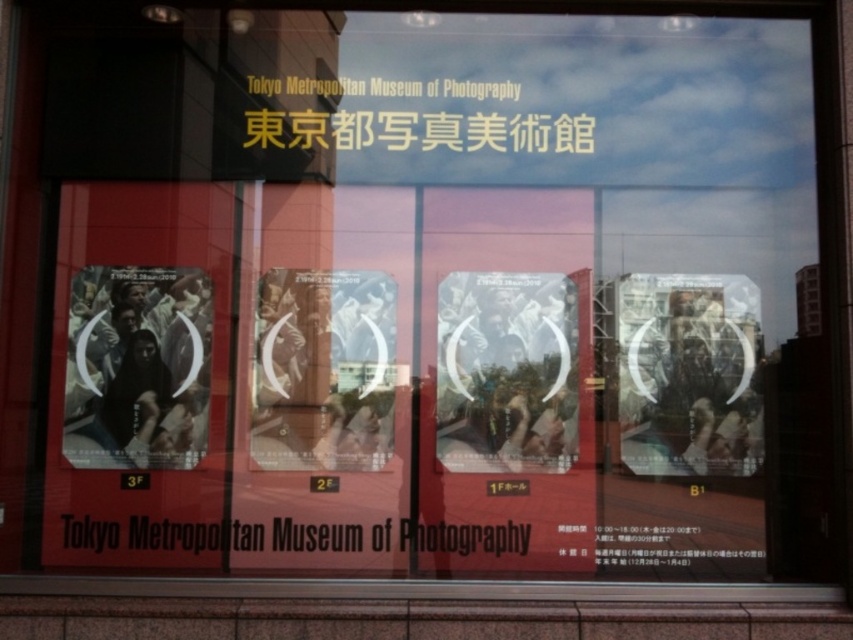
Question: Can you confirm if matte paper poster at lower left is positioned to the left of matte paper poster at center?

Choices:
 (A) no
 (B) yes

Answer: (B)

Question: Based on their relative distances, which object is nearer to the matte paper poster at lower left?

Choices:
 (A) matte paper poster at center
 (B) matte black poster at right

Answer: (A)

Question: Is matte black poster at right closer to camera compared to matte paper poster at lower left?

Choices:
 (A) yes
 (B) no

Answer: (B)

Question: Does matte black poster at right have a smaller size compared to matte paper poster at lower left?

Choices:
 (A) no
 (B) yes

Answer: (B)

Question: Which is farther from the matte black poster at right?

Choices:
 (A) matte paper poster at center
 (B) matte paper poster at lower left

Answer: (B)

Question: Which point is closer to the camera?

Choices:
 (A) matte paper poster at center
 (B) matte black poster at right
 (C) matte paper poster at lower left

Answer: (C)